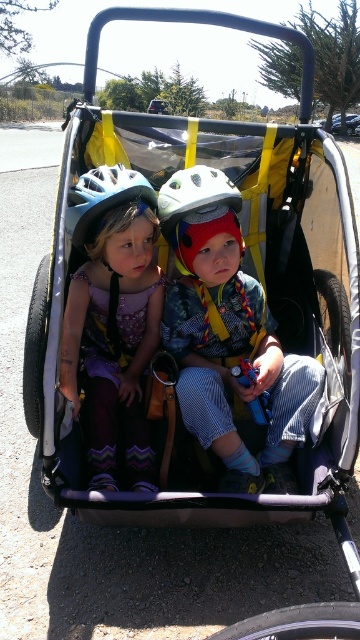
You are a photographer trying to capture a closeup of the child in the bicycle trailer. You notice two points marked on the image at coordinates point (225, 230) and point (195, 221). Which of these points is closer to your camera lens?

Point (225, 230) is closer to the camera lens than point (195, 221).

You are a safety inspector checking the bicycle trailer. You notice two helmets inside the trailer. Which helmet is positioned lower between the matte blue helmet at center and the matte white helmet at center?

The matte blue helmet at center is located below the matte white helmet at center, so it is positioned lower.

You are a safety inspector checking the bicycle trailer. You notice two helmets inside the trailer. Which helmet, the matte blue helmet at center or the matte white helmet at center, is taller?

The matte blue helmet at center is taller than the matte white helmet at center according to the description.